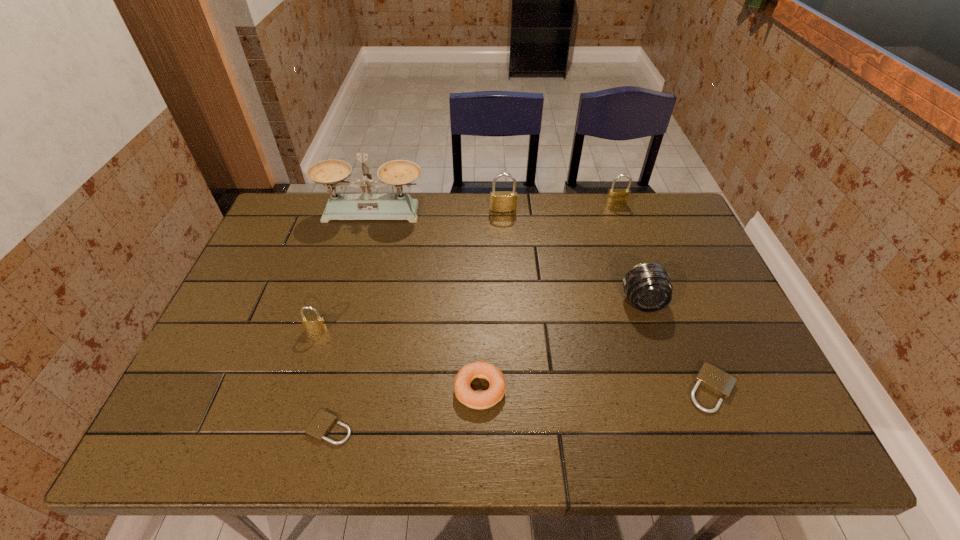
The image size is (960, 540). In order to click on the right beige padlock in this screenshot , I will do `click(712, 378)`.

You are a GUI agent. You are given a task and a screenshot of the screen. Output one action in this format:
    pyautogui.click(x=<x>, y=<y>)
    Task: Click on the seventh tallest object
    The image size is (960, 540).
    Given the screenshot: What is the action you would take?
    pyautogui.click(x=712, y=378)

This screenshot has width=960, height=540. In order to click on the second padlock from left to right in this screenshot , I will do `click(322, 423)`.

The height and width of the screenshot is (540, 960). I want to click on the shortest padlock, so click(x=322, y=423).

Where is `vacant region located on the front-facing side of the tallest object`? Image resolution: width=960 pixels, height=540 pixels. vacant region located on the front-facing side of the tallest object is located at coordinates (345, 317).

Where is `free space located on the front-facing side of the second brass padlock from right to left`? The height and width of the screenshot is (540, 960). free space located on the front-facing side of the second brass padlock from right to left is located at coordinates (509, 307).

Identify the location of vacant space located on the front-facing side of the farthest brass padlock. (636, 262).

Find the location of a particular element. The height and width of the screenshot is (540, 960). free space located 0.350m at the front element of the telephoto lens is located at coordinates (690, 446).

You are a GUI agent. You are given a task and a screenshot of the screen. Output one action in this format:
    pyautogui.click(x=<x>, y=<y>)
    Task: Click on the vacant position located on the front-facing side of the fourth nearest object
    This screenshot has width=960, height=540.
    Given the screenshot: What is the action you would take?
    pyautogui.click(x=278, y=448)

You are a GUI agent. You are given a task and a screenshot of the screen. Output one action in this format:
    pyautogui.click(x=<x>, y=<y>)
    Task: Click on the vacant area located 0.150m on the left of the bagel
    This screenshot has width=960, height=540.
    Given the screenshot: What is the action you would take?
    pyautogui.click(x=389, y=389)